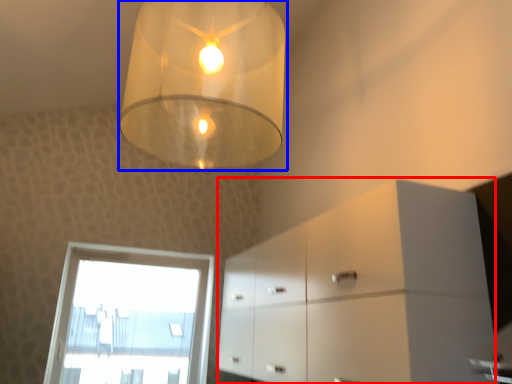
Question: Among these objects, which one is farthest to the camera, dresser (highlighted by a red box) or lamp (highlighted by a blue box)?

Choices:
 (A) dresser
 (B) lamp

Answer: (A)